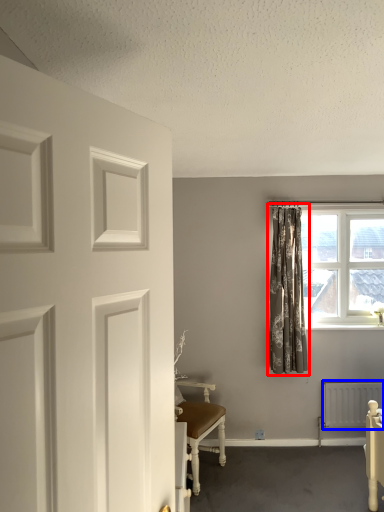
Question: Which of the following is the closest to the observer, curtain (highlighted by a red box) or radiator (highlighted by a blue box)?

Choices:
 (A) curtain
 (B) radiator

Answer: (A)